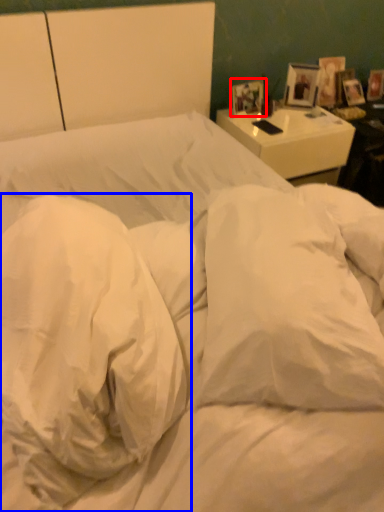
Question: Which of the following is the farthest to the observer, picture frame (highlighted by a red box) or pillow (highlighted by a blue box)?

Choices:
 (A) picture frame
 (B) pillow

Answer: (A)